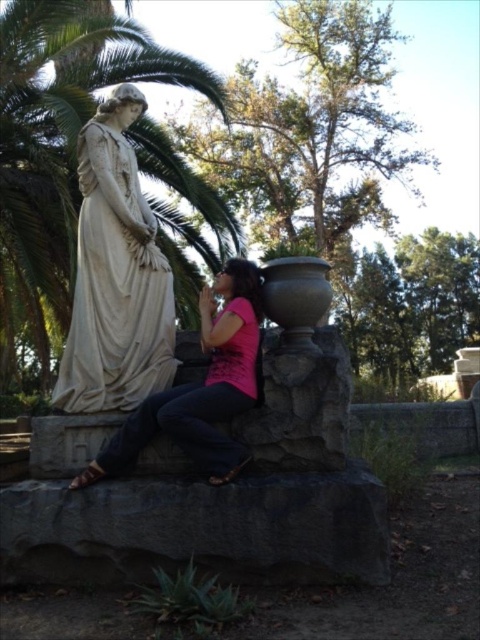
Does green leafy palm tree at upper left appear on the right side of white marble statue at left?

Correct, you'll find green leafy palm tree at upper left to the right of white marble statue at left.

Which is in front, point (64, 317) or point (137, 225)?

Point (137, 225)

In order to click on green leafy palm tree at upper left in this screenshot , I will do `click(74, 173)`.

In the scene shown: Can you confirm if white marble statue at left is positioned above matte white statue at left?

Yes, white marble statue at left is above matte white statue at left.

Can you confirm if white marble statue at left is thinner than matte white statue at left?

Yes.

Which is in front, point (85, 356) or point (233, 458)?

Point (233, 458) is in front.

At what (x,y) coordinates should I click in order to perform the action: click on white marble statue at left. Please return your answer as a coordinate pair (x, y). The height and width of the screenshot is (640, 480). Looking at the image, I should click on point(116,275).

Measure the distance from green leafy palm tree at upper left to matte white statue at left.

green leafy palm tree at upper left and matte white statue at left are 4.84 meters apart.

Is green leafy palm tree at upper left positioned before matte white statue at left?

No, it is not.

This screenshot has width=480, height=640. What do you see at coordinates (74, 173) in the screenshot?
I see `green leafy palm tree at upper left` at bounding box center [74, 173].

This screenshot has width=480, height=640. Find the location of `green leafy palm tree at upper left`. green leafy palm tree at upper left is located at coordinates (74, 173).